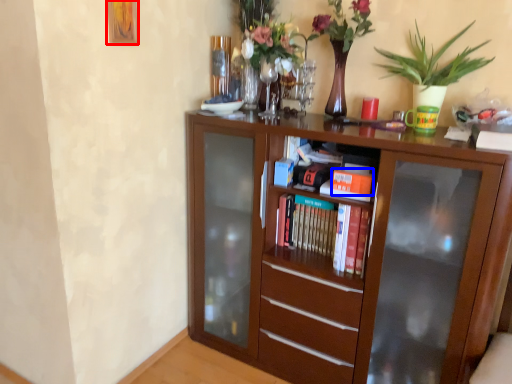
Question: Which point is closer to the camera, picture frame (highlighted by a red box) or book (highlighted by a blue box)?

Choices:
 (A) picture frame
 (B) book

Answer: (A)